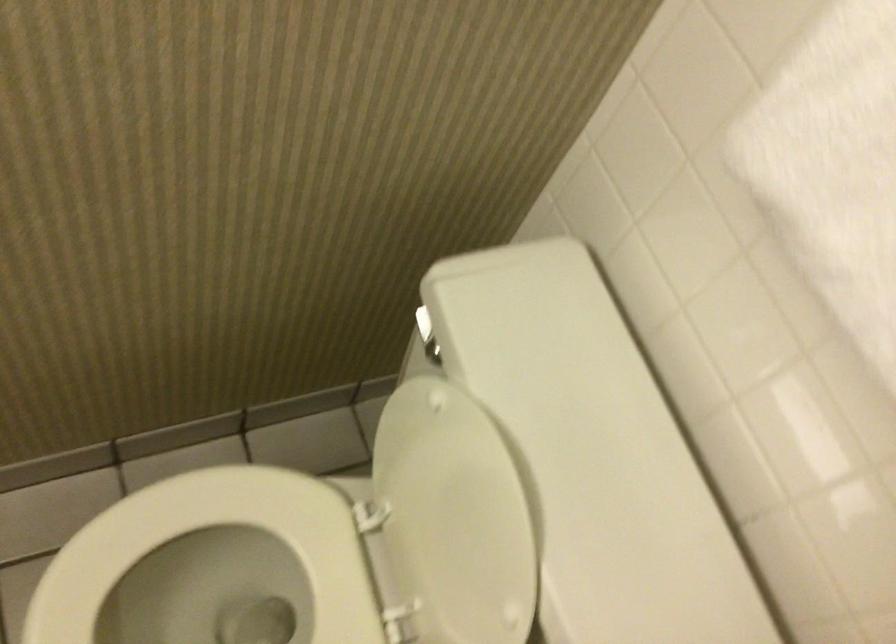
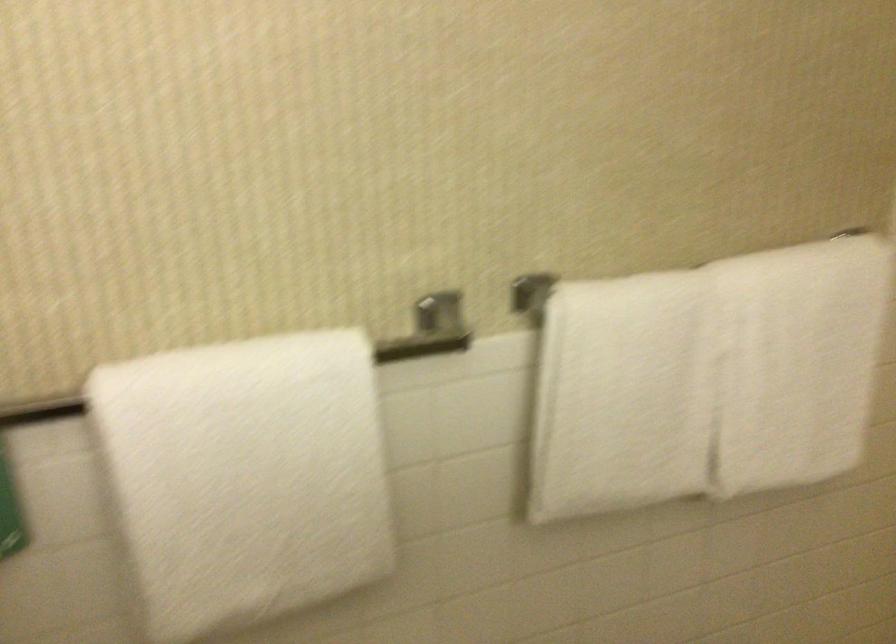
Question: How did the camera likely rotate?

Choices:
 (A) Left
 (B) Right
 (C) Up
 (D) Down

Answer: (B)